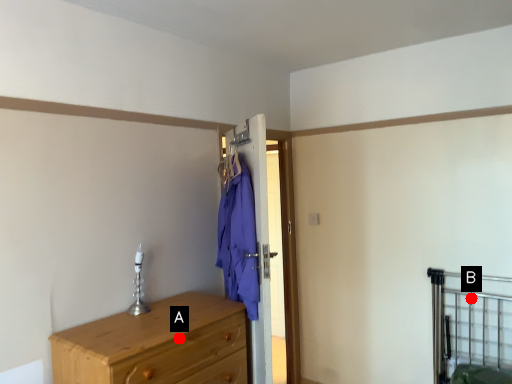
Question: Two points are circled on the image, labeled by A and B beside each circle. Which of the following is the closest to the observer?

Choices:
 (A) A is closer
 (B) B is closer

Answer: (A)